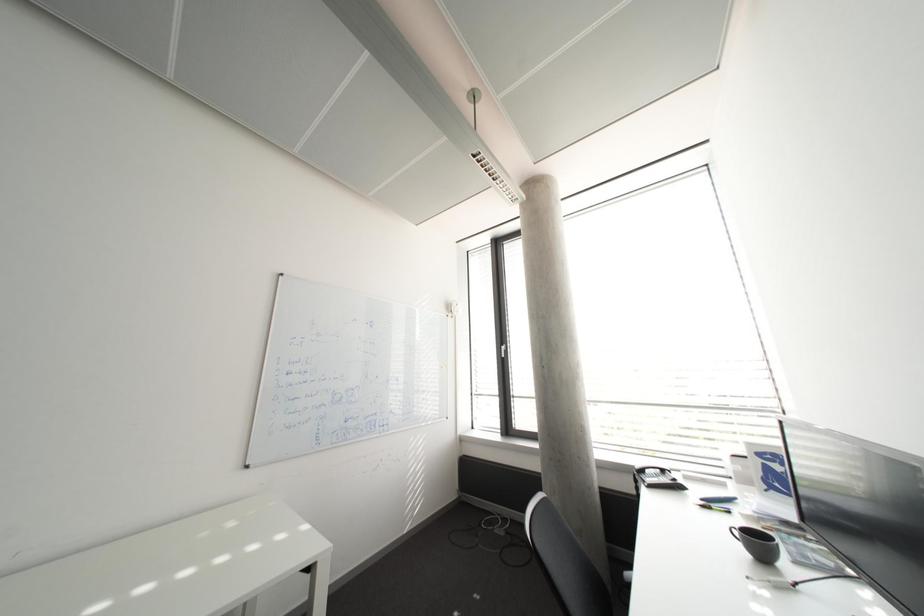
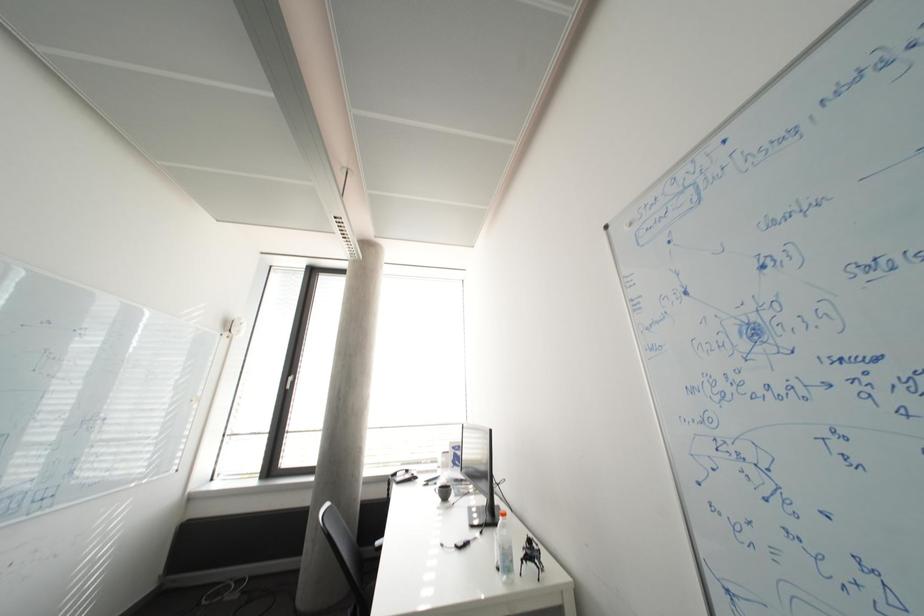
Question: The camera is either moving clockwise (left) or counter-clockwise (right) around the object. The first image is from the beginning of the video and the second image is from the end. Is the camera moving left or right when shooting the video?

Choices:
 (A) Left
 (B) Right

Answer: (A)